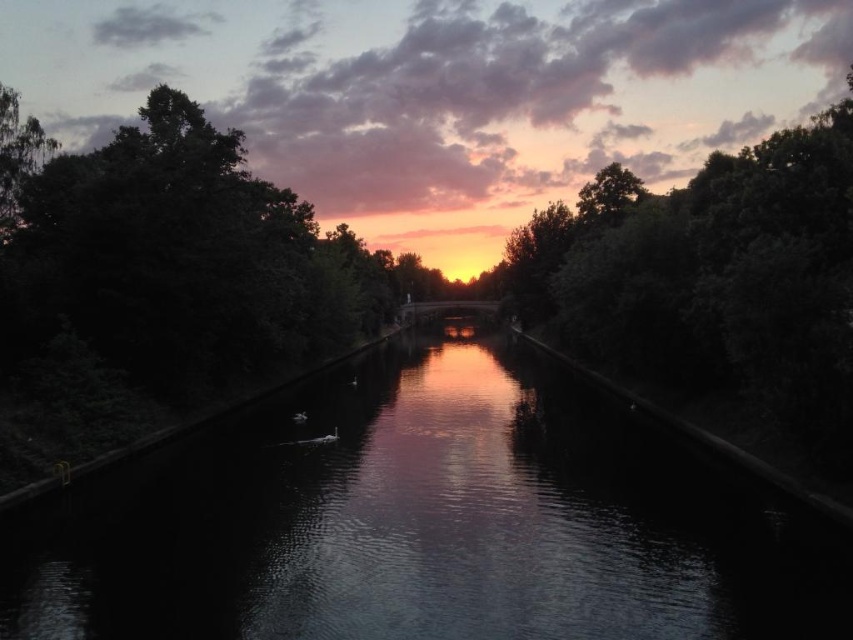
What do you see at coordinates (421, 522) in the screenshot? The image size is (853, 640). I see `dark reflective water at center` at bounding box center [421, 522].

Can you confirm if dark reflective water at center is smaller than green leafy tree at upper left?

Yes.

The width and height of the screenshot is (853, 640). What do you see at coordinates (421, 522) in the screenshot?
I see `dark reflective water at center` at bounding box center [421, 522].

The width and height of the screenshot is (853, 640). What are the coordinates of `dark reflective water at center` in the screenshot? It's located at (421, 522).

Can you confirm if dark reflective water at center is positioned to the left of green leafy tree at upper center?

Indeed, dark reflective water at center is positioned on the left side of green leafy tree at upper center.

Does dark reflective water at center appear over green leafy tree at upper center?

Incorrect, dark reflective water at center is not positioned above green leafy tree at upper center.

Does point (683, 589) come behind point (842, 397)?

No.

The image size is (853, 640). I want to click on dark reflective water at center, so click(x=421, y=522).

Which of these two, green leafy tree at upper center or green leafy tree at upper left, stands shorter?

Standing shorter between the two is green leafy tree at upper left.

Can you confirm if green leafy tree at upper center is positioned below green leafy tree at upper left?

Incorrect, green leafy tree at upper center is not positioned below green leafy tree at upper left.

Is point (747, 355) in front of point (4, 93)?

That is True.

You are a GUI agent. You are given a task and a screenshot of the screen. Output one action in this format:
    pyautogui.click(x=<x>, y=<y>)
    Task: Click on the green leafy tree at upper center
    
    Given the screenshot: What is the action you would take?
    pyautogui.click(x=712, y=276)